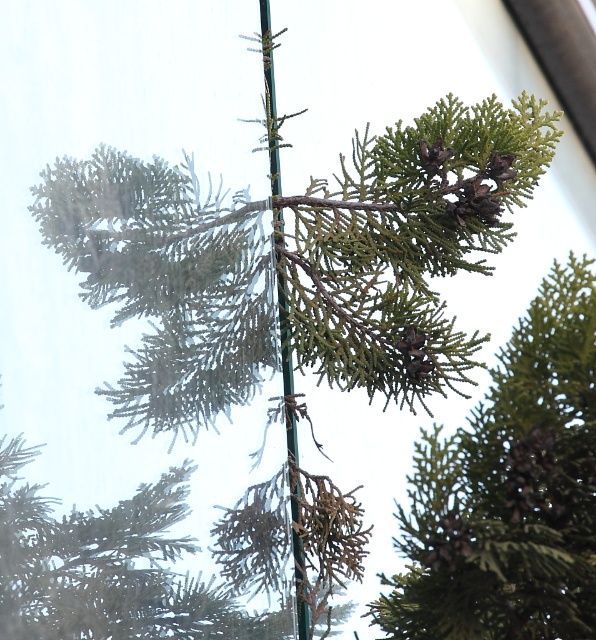
Does point (423, 621) come farther from viewer compared to point (300, 636)?

No, (423, 621) is in front of (300, 636).

This screenshot has height=640, width=596. Identify the location of green matte pine cone at center. (510, 492).